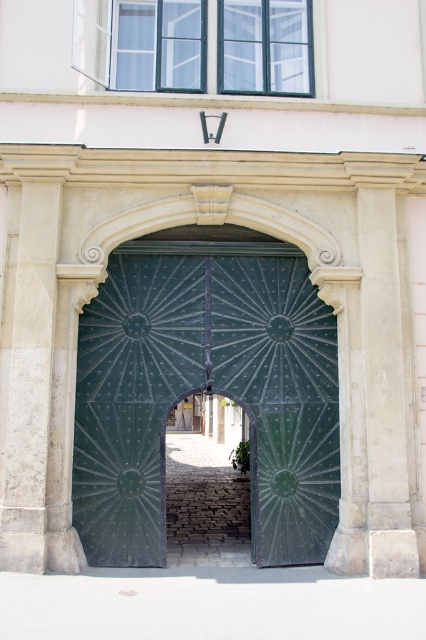
Can you confirm if green textured metal door at center is positioned below green textured gate at center?

No.

Can you confirm if green textured metal door at center is taller than green textured gate at center?

Yes.

Who is more distant from viewer, [126,384] or [236,547]?

The point [236,547] is behind.

Where is `green textured metal door at center`? The width and height of the screenshot is (426, 640). green textured metal door at center is located at coordinates (207, 390).

Can you confirm if white stone pillar at left is taller than green textured gate at center?

Yes.

Image resolution: width=426 pixels, height=640 pixels. Describe the element at coordinates (29, 380) in the screenshot. I see `white stone pillar at left` at that location.

This screenshot has height=640, width=426. What are the coordinates of `white stone pillar at left` in the screenshot? It's located at (29, 380).

Who is taller, white stone pillar at left or white stone column at right?

white stone column at right is taller.

The image size is (426, 640). I want to click on white stone pillar at left, so click(x=29, y=380).

Locate an element on the screen. This screenshot has height=640, width=426. white stone pillar at left is located at coordinates (29, 380).